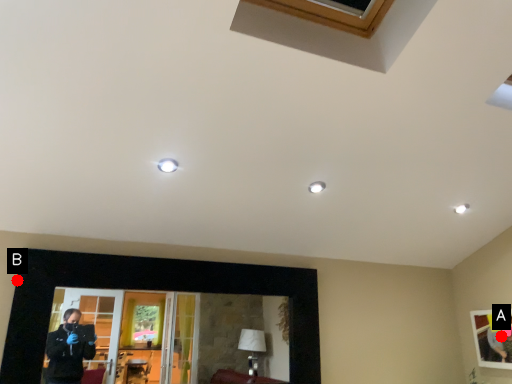
Question: Two points are circled on the image, labeled by A and B beside each circle. Which of the following is the closest to the observer?

Choices:
 (A) A is closer
 (B) B is closer

Answer: (B)